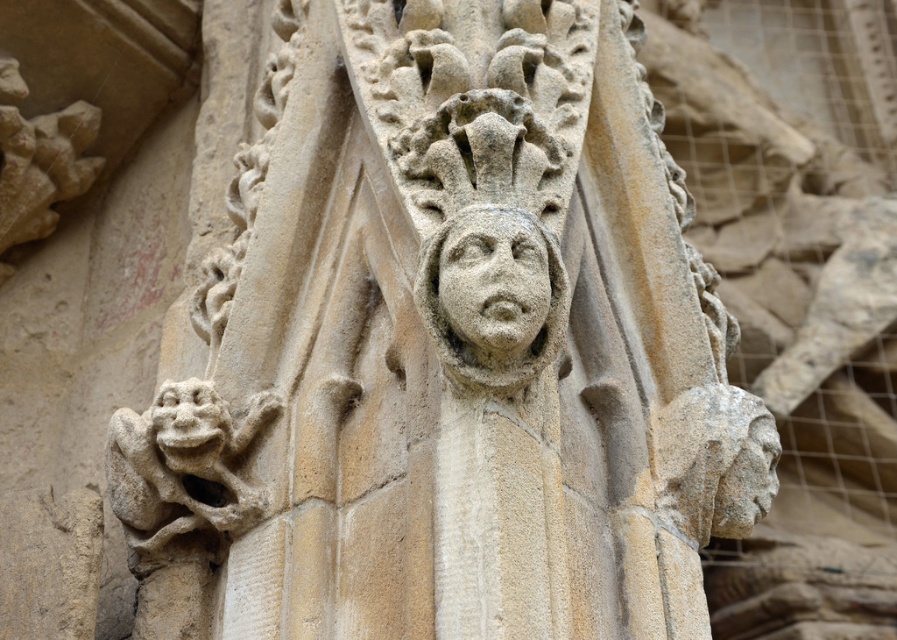
Who is shorter, stone textured gargoyle at lower left or gray stone head at center?

With less height is gray stone head at center.

Which is above, stone textured gargoyle at lower left or gray stone head at center?

gray stone head at center

Find the location of `stone textured gargoyle at lower left`. stone textured gargoyle at lower left is located at coordinates (183, 474).

Can you confirm if gray stone head at center is positioned above stone carved face at center?

Actually, gray stone head at center is below stone carved face at center.

Does gray stone head at center have a greater height compared to stone carved face at center?

Indeed, gray stone head at center has a greater height compared to stone carved face at center.

This screenshot has height=640, width=897. Identify the location of gray stone head at center. [x=713, y=461].

Locate an element on the screen. Image resolution: width=897 pixels, height=640 pixels. gray stone head at center is located at coordinates click(x=713, y=461).

Does point (207, 465) come in front of point (536, 280)?

That is False.

Does stone textured gargoyle at lower left appear over stone carved face at center?

Incorrect, stone textured gargoyle at lower left is not positioned above stone carved face at center.

What are the coordinates of `stone textured gargoyle at lower left` in the screenshot? It's located at (183, 474).